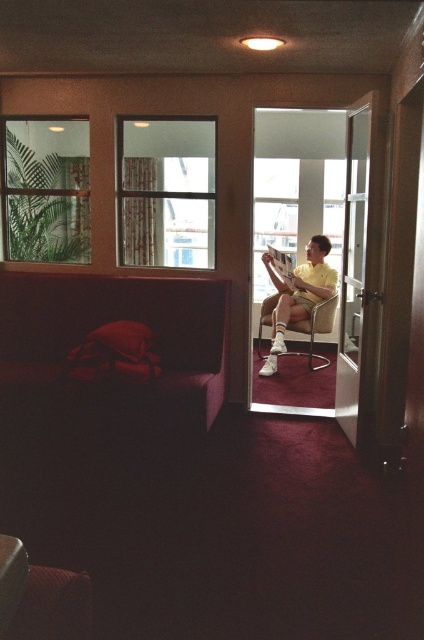
You are standing at the point marked by the coordinates point (44, 188). Looking around, you see a green leafy plant at left. Which direction should you walk to reach the dark purple sofa with a red cushion?

The point (44, 188) indicates green leafy plant at left. To reach the dark purple sofa with a red cushion, you should walk towards the right since the sofa is located on the left side of the image adjacent to the seating area.

You are standing in the hotel room and want to look outside. Where should you go to see through the clear glass window at upper center?

The clear glass window at upper center is located at point (166,192), so you should move to that coordinate to see outside.